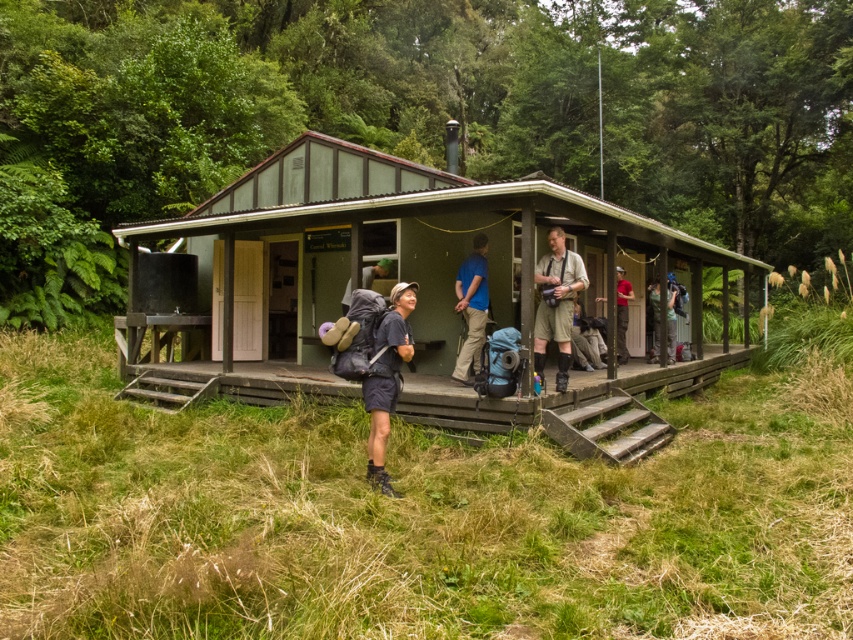
Consider the image. You are standing on the porch of the rustic wooden cabin and see the green fabric pants at center and the matte gray backpack at center. Which object is located to the right of the other?

The green fabric pants at center is positioned on the right side of matte gray backpack at center, so the green fabric pants at center is to the right of the matte gray backpack at center.

You are standing on the porch of the rustic wooden cabin and need to reach both the green fabric pants at center and the matte gray backpack at center. Given that you can only carry one item at a time, which item should you pick up first to minimize the total distance walked?

Since the green fabric pants at center and matte gray backpack at center are 7.32 meters apart, you should pick up whichever item is closer to your starting position first to minimize the total distance walked. However, without knowing the exact positions relative to the porch entrance, it is impossible to determine which item is closer. Please provide more information about their locations relative to the entrance.

Looking at this image, you are planning to set up a small table for two people on the wooden porch at center. Considering the khaki cotton shirt at center is placed on the porch, will there be enough space to place the table without moving the shirt?

The wooden porch at center is wider than the khaki cotton shirt at center, so there should be enough space to place the table without moving the shirt.